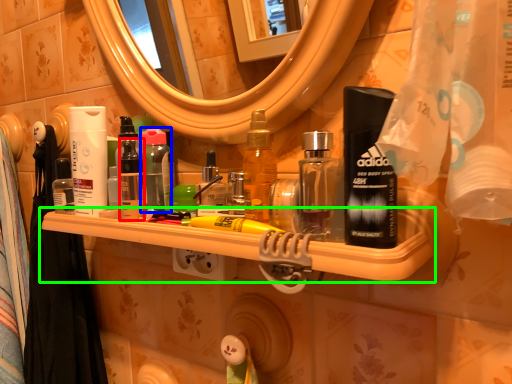
Question: Based on their relative distances, which object is nearer to toiletry (highlighted by a red box)? Choose from mouthwash (highlighted by a blue box) and shelf (highlighted by a green box).

Choices:
 (A) mouthwash
 (B) shelf

Answer: (A)